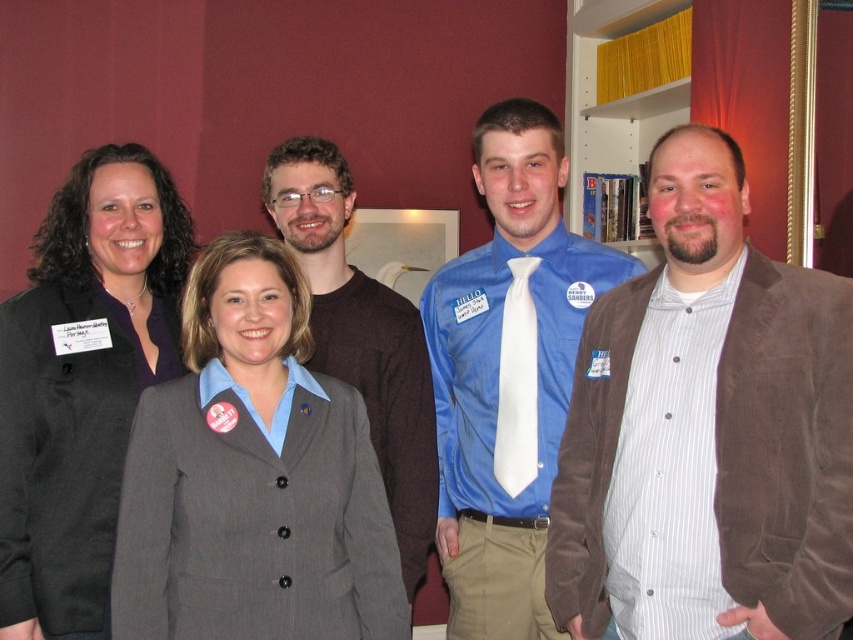
Who is positioned more to the left, matte black blazer at left or dark brown sweater at center?

Positioned to the left is matte black blazer at left.

Between matte black blazer at left and dark brown sweater at center, which one is positioned higher?

Positioned higher is dark brown sweater at center.

Identify the location of matte black blazer at left. (82, 381).

Is point (779, 412) positioned after point (518, 304)?

No, (779, 412) is in front of (518, 304).

Is point (793, 636) positioned after point (482, 147)?

That is False.

Image resolution: width=853 pixels, height=640 pixels. Find the location of `brown corduroy blazer at right`. brown corduroy blazer at right is located at coordinates (706, 432).

Between dark brown sweater at center and white silk tie at center, which one appears on the right side from the viewer's perspective?

white silk tie at center is more to the right.

Based on the photo, is dark brown sweater at center wider than white silk tie at center?

Correct, the width of dark brown sweater at center exceeds that of white silk tie at center.

Is point (373, 342) farther from camera compared to point (509, 420)?

Yes, point (373, 342) is farther from viewer.

Where is `dark brown sweater at center`? dark brown sweater at center is located at coordinates (361, 336).